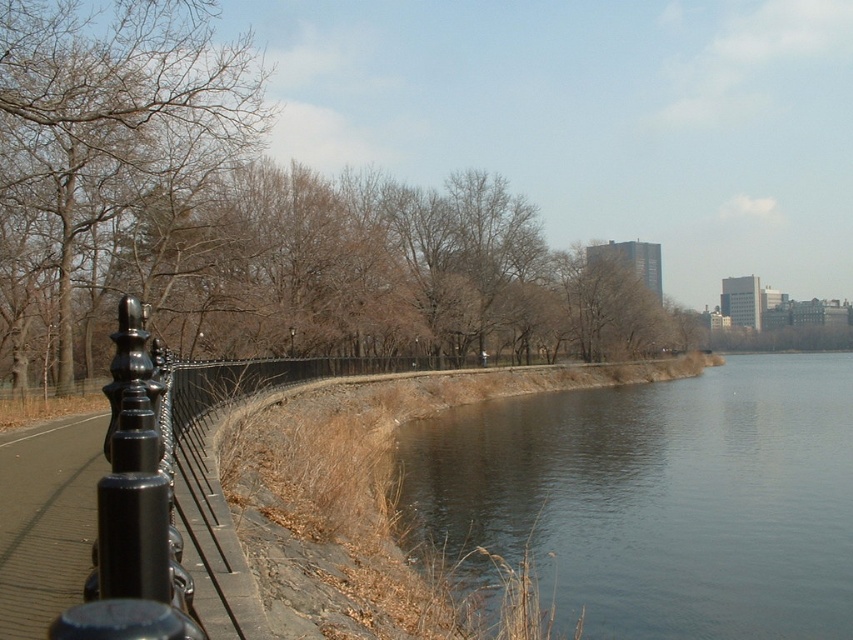
You are standing on the pathway and looking towards the river. You see a brown leafy tree at left and a brown leafless tree at left. Which tree is closer to the sky?

The brown leafy tree at left is above the brown leafless tree at left, so it is closer to the sky.

You are standing at the point marked by the coordinates point (x=103, y=150) in the riverside scene. Which object from the scene is located exactly at this coordinate?

The brown leafless tree at left is located exactly at the coordinates point (x=103, y=150).